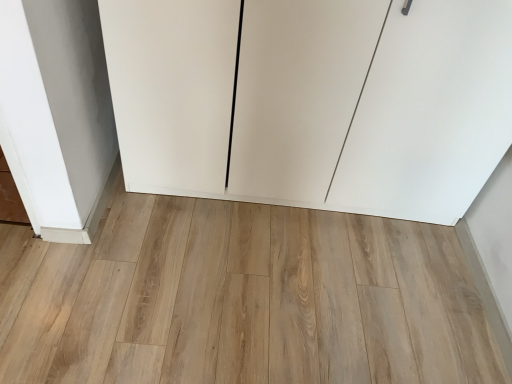
The width and height of the screenshot is (512, 384). I want to click on vacant space in front of white matte cupboard at center, so click(x=267, y=289).